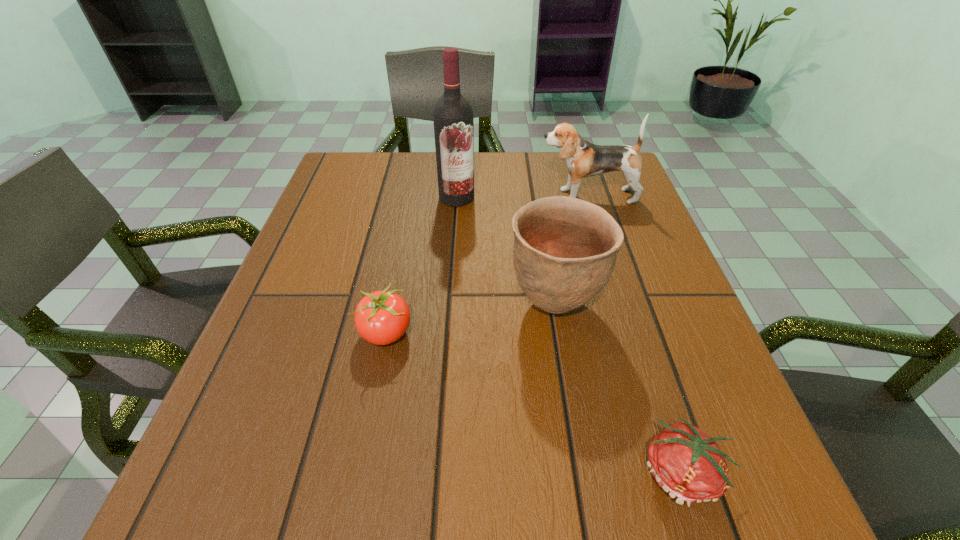
Where is `free region located at the face of the puppy`? This screenshot has width=960, height=540. free region located at the face of the puppy is located at coordinates (428, 196).

You are a GUI agent. You are given a task and a screenshot of the screen. Output one action in this format:
    pyautogui.click(x=<x>, y=<y>)
    Task: Click on the free space located 0.120m at the face of the puppy
    
    Given the screenshot: What is the action you would take?
    pyautogui.click(x=490, y=196)

At what (x,y) coordinates should I click in order to perform the action: click on vacant area located on the front of the pottery. Please return your answer as a coordinate pair (x, y). Looking at the image, I should click on (585, 491).

Where is `free region located 0.380m on the back of the farther tomato`? free region located 0.380m on the back of the farther tomato is located at coordinates (413, 197).

Where is `wine bottle at the far edge`? wine bottle at the far edge is located at coordinates (453, 118).

Where is `puppy that is at the far edge`? puppy that is at the far edge is located at coordinates (584, 159).

At what (x,y) coordinates should I click in order to perform the action: click on object situated at the near edge. Please return your answer as a coordinate pair (x, y). The width and height of the screenshot is (960, 540). Looking at the image, I should click on (686, 463).

Image resolution: width=960 pixels, height=540 pixels. Identify the location of puppy positioned at the right edge. (584, 159).

Find the location of a particular element. This screenshot has height=540, width=960. tomato that is at the right edge is located at coordinates click(x=686, y=463).

Identify the location of object at the far right corner. The height and width of the screenshot is (540, 960). (584, 159).